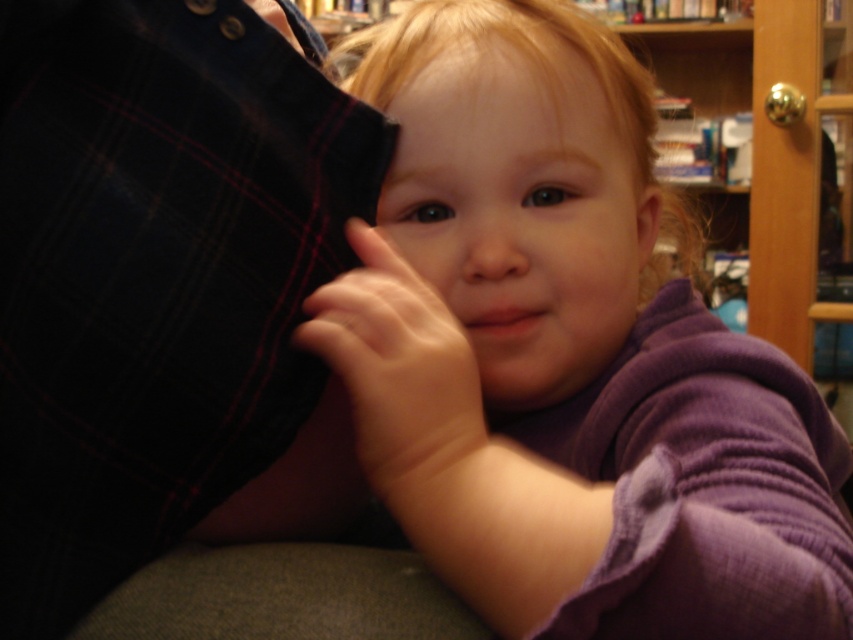
Looking at the image, which object is positioned to the right of the other between the purple soft fabric baby at center and the smooth skin hand at center?

The purple soft fabric baby at center is positioned to the right of the smooth skin hand at center.

What is the exact position of the purple soft fabric baby at center in the image?

The purple soft fabric baby at center is located at point coordinates of 0.558 on the x axis and 0.665 on the y axis.